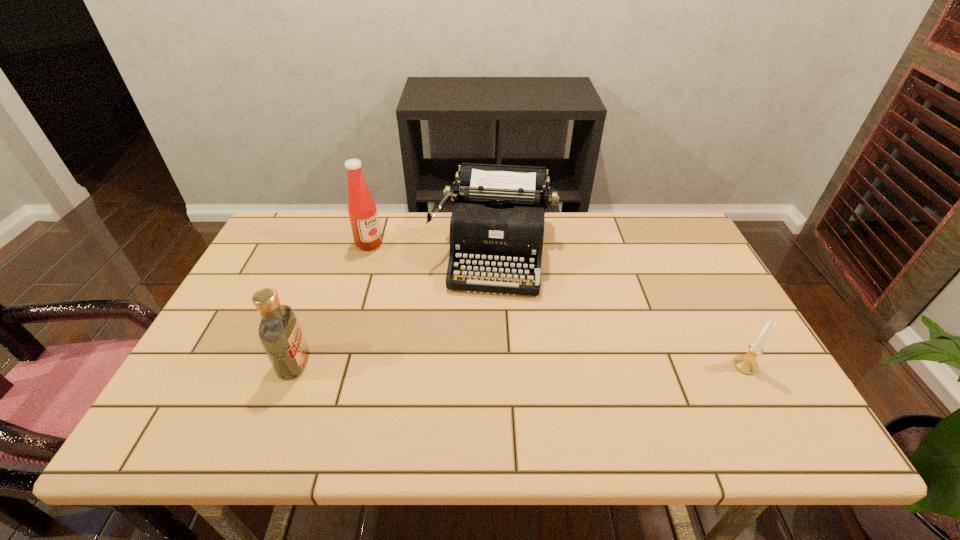
Locate an element on the screen. The image size is (960, 540). free space located on the typing side of the typewriter is located at coordinates (485, 326).

Locate an element on the screen. The width and height of the screenshot is (960, 540). free spot located on the front-facing side of the tallest object is located at coordinates tap(459, 315).

Where is `vacant area located on the front-facing side of the tallest object`? The image size is (960, 540). vacant area located on the front-facing side of the tallest object is located at coordinates (415, 280).

The image size is (960, 540). In order to click on free space located 0.240m on the front-facing side of the tallest object in this screenshot , I will do `click(425, 288)`.

Find the location of a particular element. Image resolution: width=960 pixels, height=540 pixels. typewriter at the far edge is located at coordinates (497, 223).

Locate an element on the screen. Image resolution: width=960 pixels, height=540 pixels. condiment positioned at the far edge is located at coordinates (362, 211).

The image size is (960, 540). What are the coordinates of `vodka that is positioned at the near edge` in the screenshot? It's located at (279, 332).

The image size is (960, 540). Find the location of `candle holder situated at the near edge`. candle holder situated at the near edge is located at coordinates [x=746, y=364].

Locate an element on the screen. object present at the right edge is located at coordinates (746, 364).

Locate an element on the screen. This screenshot has width=960, height=540. object situated at the near right corner is located at coordinates (746, 364).